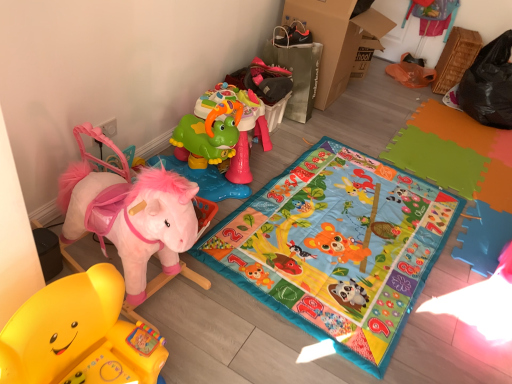
Question: Is plush pink horse at left, which is the second toy in front-to-back order, not inside green plastic toy at upper center, which is counted as the 1th toy, starting from the back?

Choices:
 (A) yes
 (B) no

Answer: (A)

Question: From a real-world perspective, is plush pink horse at left, marked as the 2th toy in a back-to-front arrangement, over green plastic toy at upper center, which is counted as the 1th toy, starting from the back?

Choices:
 (A) yes
 (B) no

Answer: (A)

Question: From a real-world perspective, does plush pink horse at left, which is the second toy in front-to-back order, sit lower than green plastic toy at upper center, which is counted as the 1th toy, starting from the back?

Choices:
 (A) yes
 (B) no

Answer: (B)

Question: Is plush pink horse at left, which is the second toy in front-to-back order, facing towards green plastic toy at upper center, which is counted as the 1th toy, starting from the back?

Choices:
 (A) no
 (B) yes

Answer: (A)

Question: Considering the relative sizes of plush pink horse at left, which is the second toy in front-to-back order, and green plastic toy at upper center, the third toy positioned from the front, in the image provided, is plush pink horse at left, which is the second toy in front-to-back order, smaller than green plastic toy at upper center, the third toy positioned from the front,?

Choices:
 (A) yes
 (B) no

Answer: (B)

Question: Would you say green plastic toy at upper center, which is counted as the 1th toy, starting from the back, is part of plush pink horse at left, marked as the 2th toy in a back-to-front arrangement,'s contents?

Choices:
 (A) yes
 (B) no

Answer: (B)

Question: Could you tell me if rubber yellow rocking horse at lower left, which is the 1th toy from front to back, is facing green plastic toy at upper center, which is counted as the 1th toy, starting from the back?

Choices:
 (A) yes
 (B) no

Answer: (B)

Question: Can you confirm if rubber yellow rocking horse at lower left, which is the 1th toy from front to back, is shorter than green plastic toy at upper center, the third toy positioned from the front?

Choices:
 (A) no
 (B) yes

Answer: (B)

Question: Is rubber yellow rocking horse at lower left, which is the 1th toy from front to back, thinner than green plastic toy at upper center, which is counted as the 1th toy, starting from the back?

Choices:
 (A) no
 (B) yes

Answer: (B)

Question: Is rubber yellow rocking horse at lower left, which is the 3th toy in back-to-front order, next to green plastic toy at upper center, which is counted as the 1th toy, starting from the back?

Choices:
 (A) yes
 (B) no

Answer: (B)

Question: Can you confirm if rubber yellow rocking horse at lower left, which is the 3th toy in back-to-front order, is taller than green plastic toy at upper center, the third toy positioned from the front?

Choices:
 (A) no
 (B) yes

Answer: (A)

Question: From the image's perspective, does rubber yellow rocking horse at lower left, which is the 3th toy in back-to-front order, appear lower than green plastic toy at upper center, which is counted as the 1th toy, starting from the back?

Choices:
 (A) yes
 (B) no

Answer: (A)

Question: Considering the relative positions of cardboard at upper right and multicolored fabric play mat at center in the image provided, is cardboard at upper right in front of multicolored fabric play mat at center?

Choices:
 (A) no
 (B) yes

Answer: (A)